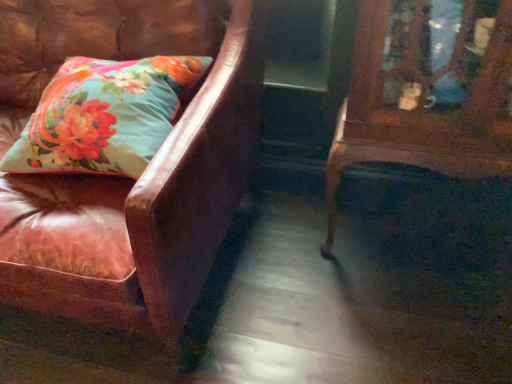
Question: Which is correct: leather couch at left is inside mahogany wood side table at right, or outside of it?

Choices:
 (A) outside
 (B) inside

Answer: (A)

Question: Considering the positions of leather couch at left and mahogany wood side table at right in the image, is leather couch at left taller or shorter than mahogany wood side table at right?

Choices:
 (A) tall
 (B) short

Answer: (A)

Question: Estimate the real-world distances between objects in this image. Which object is farther from the mahogany wood side table at right?

Choices:
 (A) leather couch at left
 (B) floral fabric pillow at left

Answer: (B)

Question: Which is nearer to the floral fabric pillow at left?

Choices:
 (A) leather couch at left
 (B) mahogany wood side table at right

Answer: (A)